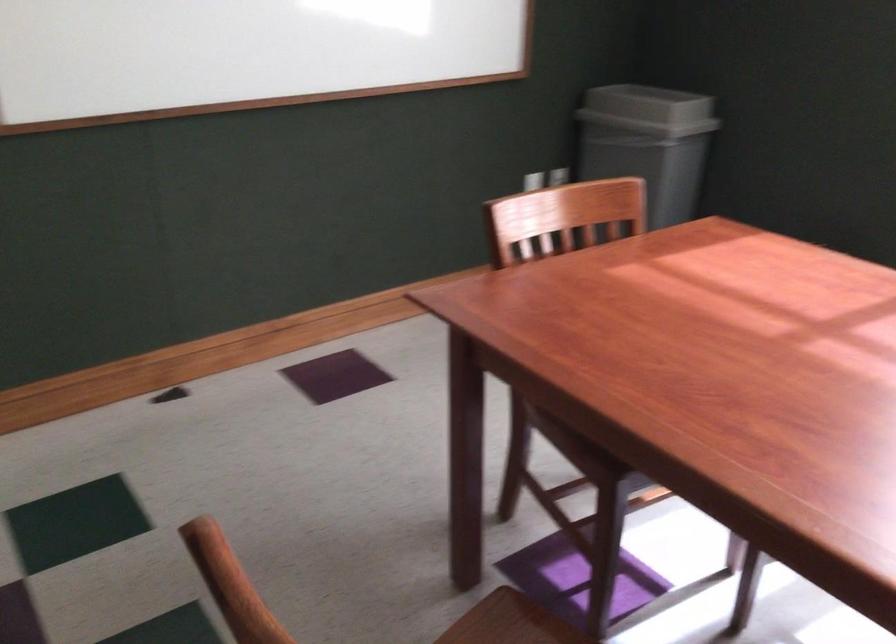
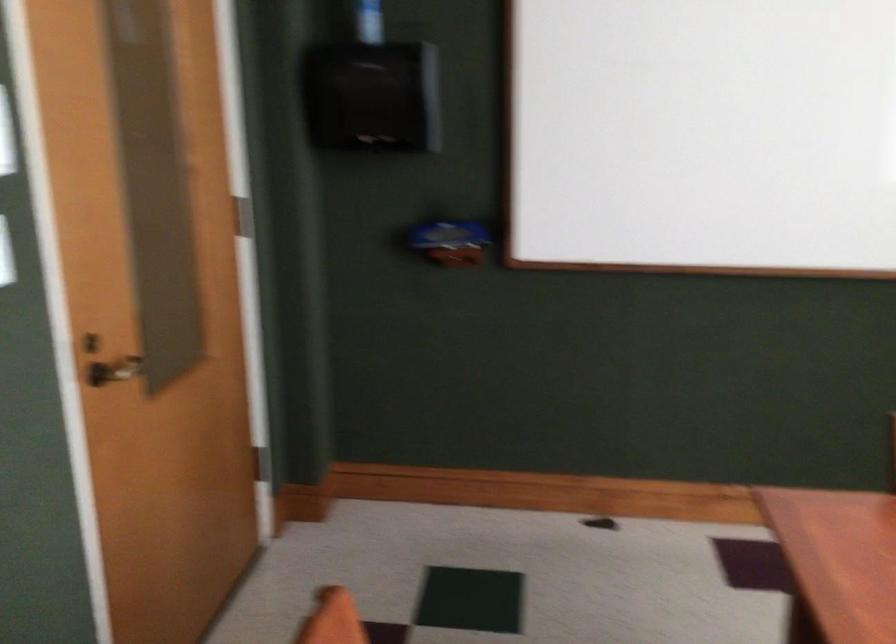
Question: The camera is either moving clockwise (left) or counter-clockwise (right) around the object. The first image is from the beginning of the video and the second image is from the end. Is the camera moving left or right when shooting the video?

Choices:
 (A) Left
 (B) Right

Answer: (B)